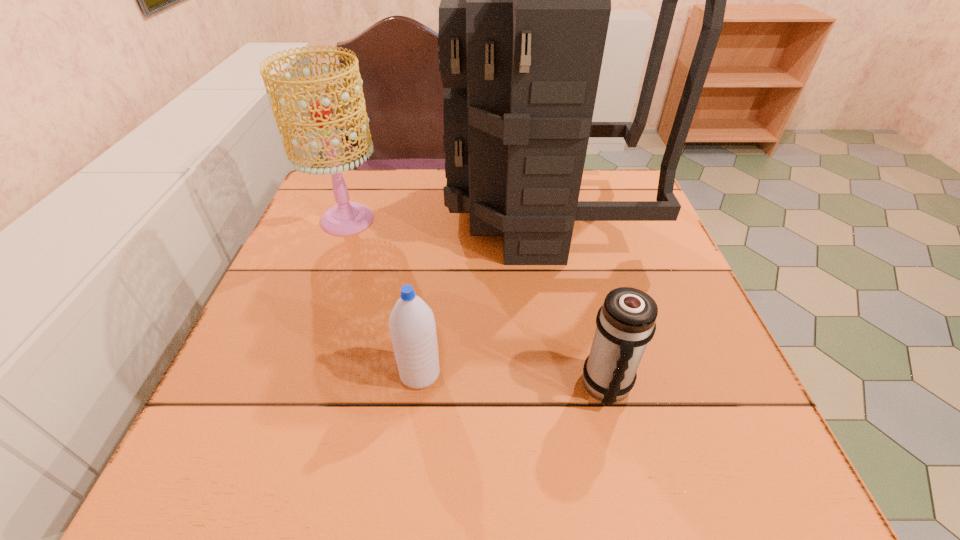
At what (x,y) coordinates should I click in order to perform the action: click on vacant area situated on the side with the handle of the thermos bottle. Please return your answer as a coordinate pair (x, y). The width and height of the screenshot is (960, 540). Looking at the image, I should click on (625, 461).

I want to click on backpack located at the far edge, so click(525, 5).

Where is `lampshade that is at the far edge`? lampshade that is at the far edge is located at coordinates (346, 218).

In order to click on object located in the left edge section of the desktop in this screenshot , I will do `click(346, 218)`.

Identify the location of object located in the right edge section of the desktop. This screenshot has width=960, height=540. (525, 5).

Locate an element on the screen. The height and width of the screenshot is (540, 960). object that is at the far left corner is located at coordinates (346, 218).

What are the coordinates of `object present at the far right corner` in the screenshot? It's located at (525, 5).

In the image, there is a desktop. What are the coordinates of `vacant space at the far edge` in the screenshot? It's located at tap(395, 169).

In the image, there is a desktop. Where is `vacant space at the near edge`? vacant space at the near edge is located at coordinates (358, 434).

The height and width of the screenshot is (540, 960). What are the coordinates of `vacant space at the left edge of the desktop` in the screenshot? It's located at (298, 405).